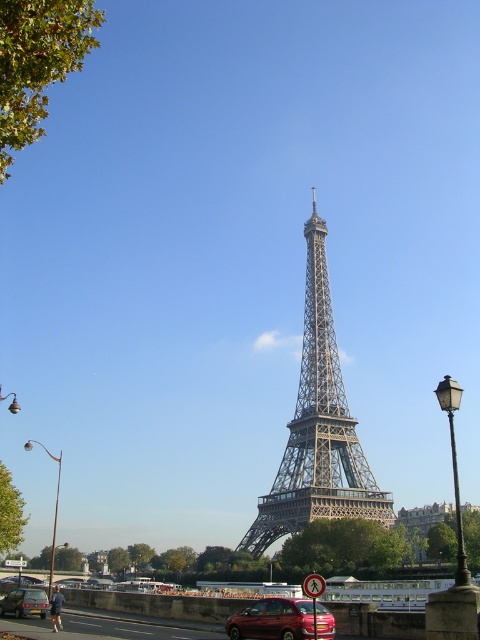
You are standing at the base of the Eiffel Tower and want to take a photo of the metallic red car at center. In which direction should you walk to get a better view of the car?

The metallic red car at center is located at point (280, 620), so you should walk towards the right side of the frame to get a better view of the car.

You are standing at the base of the Eiffel Tower and see a point marked at coordinate [280,620]. What object is located at that point?

The point at coordinate [280,620] indicates the metallic red car at center.